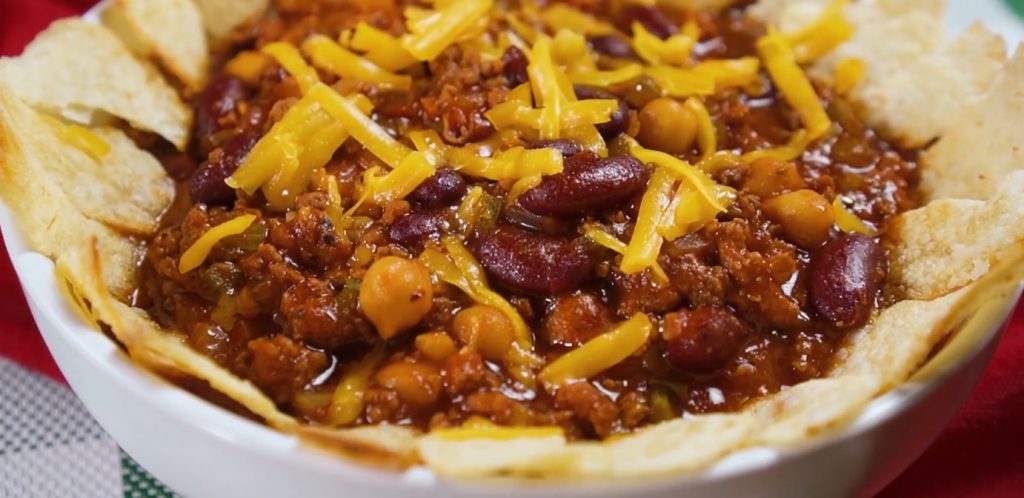
This screenshot has width=1024, height=498. What are the coordinates of `checkered tablecloth` in the screenshot? It's located at (78, 455).